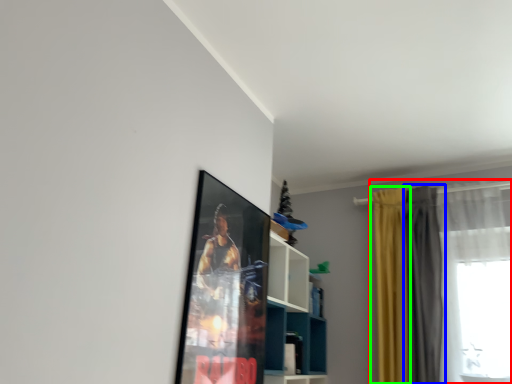
Question: Based on their relative distances, which object is farther from curtain (highlighted by a red box)? Choose from curtain (highlighted by a blue box) and curtain (highlighted by a green box).

Choices:
 (A) curtain
 (B) curtain

Answer: (B)